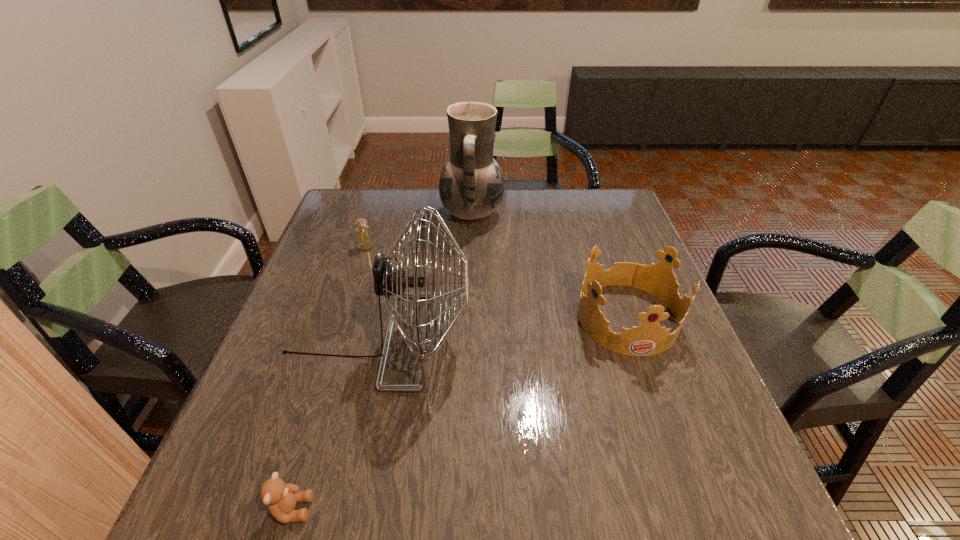
I want to click on the farthest object, so click(471, 185).

Image resolution: width=960 pixels, height=540 pixels. What are the coordinates of `fan` in the screenshot? It's located at (389, 282).

Image resolution: width=960 pixels, height=540 pixels. In order to click on the third tallest object in this screenshot , I will do `click(648, 339)`.

Identify the location of tiara. (648, 339).

At what (x,y) coordinates should I click in order to perform the action: click on the fourth nearest object. Please return your answer as a coordinate pair (x, y). This screenshot has width=960, height=540. Looking at the image, I should click on (364, 241).

Find the location of `the nearest object`. the nearest object is located at coordinates (281, 498).

I want to click on free space located 0.340m on the front-facing side of the pitcher, so pos(613,214).

This screenshot has width=960, height=540. What are the coordinates of `free space located on the front-facing side of the fan` in the screenshot? It's located at (550, 340).

At what (x,y) coordinates should I click in order to perform the action: click on free space located on the front-facing side of the rightmost object. Please return your answer as a coordinate pair (x, y). Looking at the image, I should click on (684, 485).

Locate an element on the screen. Image resolution: width=960 pixels, height=540 pixels. free spot located 0.300m on the front of the saltshaker is located at coordinates (338, 333).